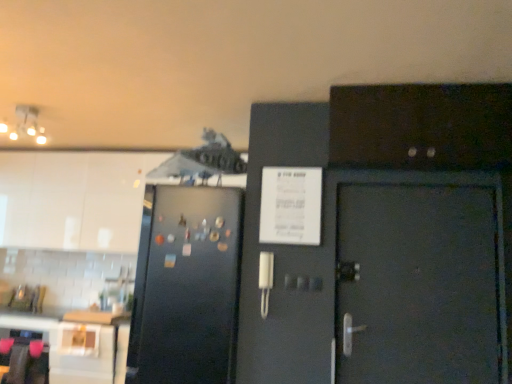
Question: Is matte white ceiling light at upper left turned away from black matte refrigerator at left?

Choices:
 (A) no
 (B) yes

Answer: (A)

Question: From the image's perspective, would you say matte white ceiling light at upper left is shown under black matte refrigerator at left?

Choices:
 (A) yes
 (B) no

Answer: (B)

Question: From the image's perspective, is matte white ceiling light at upper left on black matte refrigerator at left?

Choices:
 (A) yes
 (B) no

Answer: (A)

Question: Is matte white ceiling light at upper left positioned far away from black matte refrigerator at left?

Choices:
 (A) yes
 (B) no

Answer: (A)

Question: Is matte white ceiling light at upper left next to black matte refrigerator at left and touching it?

Choices:
 (A) yes
 (B) no

Answer: (B)

Question: From a real-world perspective, does matte white ceiling light at upper left stand above black matte refrigerator at left?

Choices:
 (A) no
 (B) yes

Answer: (B)

Question: Does matte white ceiling light at upper left have a lesser height compared to dark wood cabinet at upper right, marked as the 1th cabinetry in a right-to-left arrangement?

Choices:
 (A) yes
 (B) no

Answer: (A)

Question: Is matte white ceiling light at upper left further to the viewer compared to dark wood cabinet at upper right, positioned as the second cabinetry in left-to-right order?

Choices:
 (A) yes
 (B) no

Answer: (A)

Question: From the image's perspective, is matte white ceiling light at upper left over dark wood cabinet at upper right, placed as the 1th cabinetry when sorted from front to back?

Choices:
 (A) no
 (B) yes

Answer: (B)

Question: Can you confirm if matte white ceiling light at upper left is taller than dark wood cabinet at upper right, arranged as the second cabinetry when viewed from the back?

Choices:
 (A) yes
 (B) no

Answer: (B)

Question: Is matte white ceiling light at upper left oriented towards dark wood cabinet at upper right, marked as the 1th cabinetry in a right-to-left arrangement?

Choices:
 (A) yes
 (B) no

Answer: (B)

Question: Is matte white ceiling light at upper left to the right of dark wood cabinet at upper right, arranged as the second cabinetry when viewed from the back, from the viewer's perspective?

Choices:
 (A) no
 (B) yes

Answer: (A)

Question: Can you confirm if dark wood cabinet at upper right, arranged as the second cabinetry when viewed from the back, is smaller than black matte refrigerator at left?

Choices:
 (A) yes
 (B) no

Answer: (A)